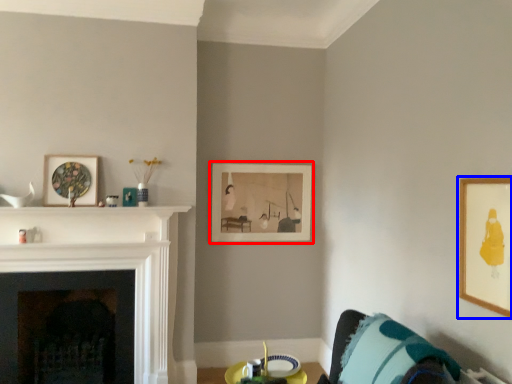
Question: Which of the following is the closest to the observer, picture frame (highlighted by a red box) or picture frame (highlighted by a blue box)?

Choices:
 (A) picture frame
 (B) picture frame

Answer: (B)